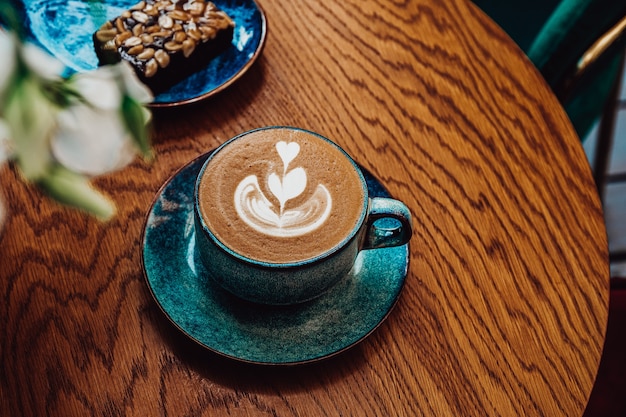
Locate an element on the screen. The width and height of the screenshot is (626, 417). stool is located at coordinates (606, 139).